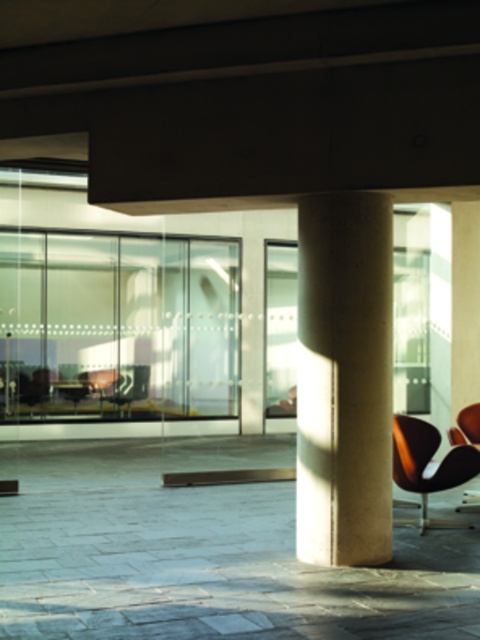
Does point (172, 408) come farther from viewer compared to point (453, 472)?

Yes, it is.

How far apart are transparent glass door at center and brown leather armchair at lower right?

The distance of transparent glass door at center from brown leather armchair at lower right is 7.51 meters.

Where is `transparent glass door at center`? transparent glass door at center is located at coordinates (118, 324).

In the scene shown: Does transparent glass door at center have a greater height compared to smooth concrete pillar at center?

Yes, transparent glass door at center is taller than smooth concrete pillar at center.

Locate an element on the screen. This screenshot has height=640, width=480. transparent glass door at center is located at coordinates (118, 324).

Image resolution: width=480 pixels, height=640 pixels. What do you see at coordinates (344, 378) in the screenshot? I see `smooth concrete pillar at center` at bounding box center [344, 378].

Is smooth concrete pillar at center to the right of brown leather armchair at lower right from the viewer's perspective?

In fact, smooth concrete pillar at center is to the left of brown leather armchair at lower right.

Who is more forward, (369, 355) or (477, 458)?

Point (369, 355)

At what (x,y) coordinates should I click in order to perform the action: click on smooth concrete pillar at center. Please return your answer as a coordinate pair (x, y). The height and width of the screenshot is (640, 480). Looking at the image, I should click on point(344,378).